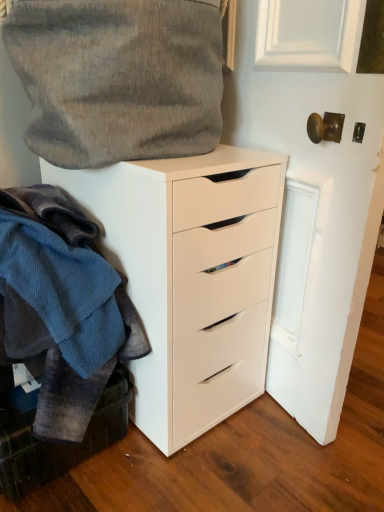
Question: Does white matte cabinet at lower left have a greater width compared to white matte chest of drawers at center?

Choices:
 (A) yes
 (B) no

Answer: (B)

Question: From a real-world perspective, is white matte cabinet at lower left under white matte chest of drawers at center?

Choices:
 (A) yes
 (B) no

Answer: (A)

Question: Is white matte cabinet at lower left not within white matte chest of drawers at center?

Choices:
 (A) no
 (B) yes

Answer: (B)

Question: Can you confirm if white matte cabinet at lower left is shorter than white matte chest of drawers at center?

Choices:
 (A) yes
 (B) no

Answer: (A)

Question: Is white matte cabinet at lower left far away from white matte chest of drawers at center?

Choices:
 (A) no
 (B) yes

Answer: (A)

Question: Is white matte cabinet at lower left to the right of white matte chest of drawers at center from the viewer's perspective?

Choices:
 (A) no
 (B) yes

Answer: (A)

Question: Can you confirm if textured gray fabric at upper left is smaller than white matte chest of drawers at center?

Choices:
 (A) yes
 (B) no

Answer: (A)

Question: Is textured gray fabric at upper left placed right next to white matte chest of drawers at center?

Choices:
 (A) yes
 (B) no

Answer: (B)

Question: Can you confirm if textured gray fabric at upper left is positioned to the left of white matte chest of drawers at center?

Choices:
 (A) no
 (B) yes

Answer: (B)

Question: From a real-world perspective, does textured gray fabric at upper left stand above white matte chest of drawers at center?

Choices:
 (A) yes
 (B) no

Answer: (A)

Question: Considering the relative positions of textured gray fabric at upper left and white matte chest of drawers at center in the image provided, is textured gray fabric at upper left behind white matte chest of drawers at center?

Choices:
 (A) no
 (B) yes

Answer: (A)

Question: Does textured gray fabric at upper left have a lesser height compared to white matte chest of drawers at center?

Choices:
 (A) yes
 (B) no

Answer: (A)

Question: Does white matte cabinet at lower left have a smaller size compared to knitted wool sweater at left?

Choices:
 (A) no
 (B) yes

Answer: (B)